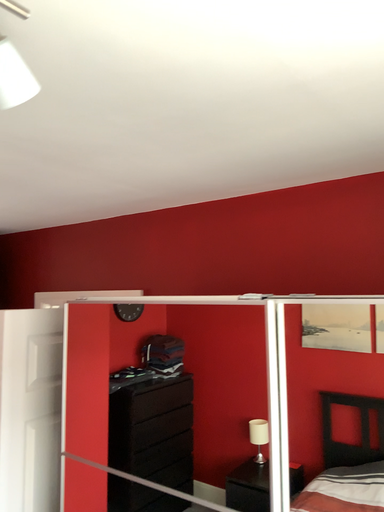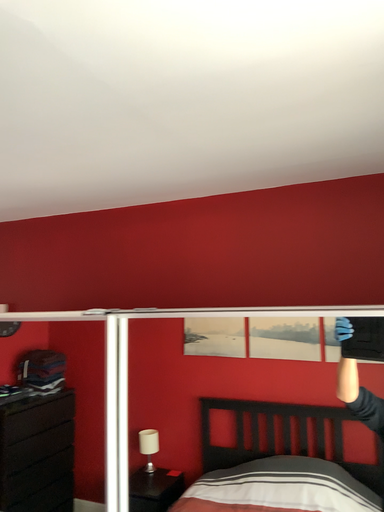
Question: How did the camera likely rotate when shooting the video?

Choices:
 (A) rotated left
 (B) rotated right

Answer: (B)